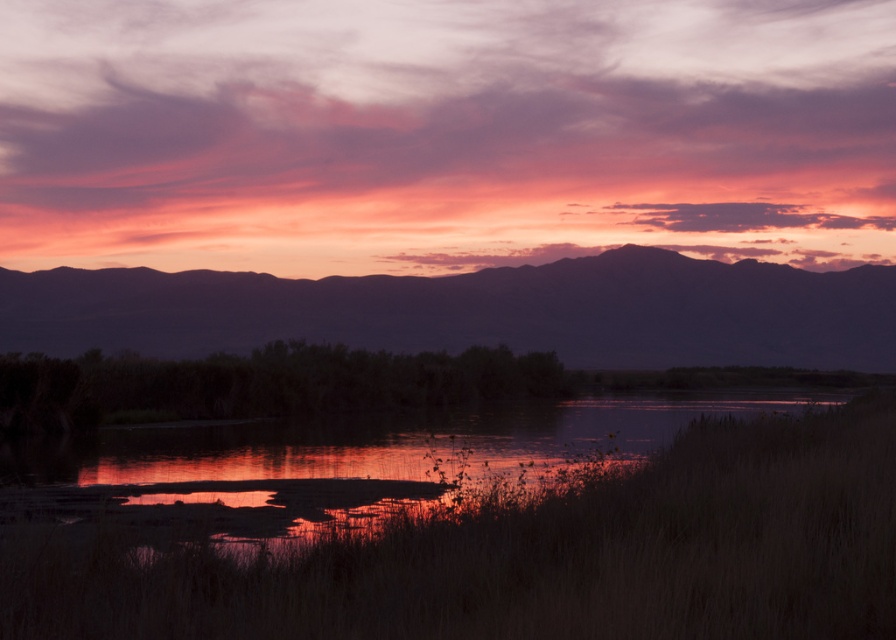
Question: Is silvery metallic mountain at upper center to the right of reflective wetland at center from the viewer's perspective?

Choices:
 (A) no
 (B) yes

Answer: (B)

Question: Among these objects, which one is farthest from the camera?

Choices:
 (A) silvery metallic mountain at upper center
 (B) reflective wetland at center

Answer: (A)

Question: Which object is farther from the camera taking this photo?

Choices:
 (A) reflective wetland at center
 (B) silvery metallic mountain at upper center

Answer: (B)

Question: Can you confirm if silvery metallic mountain at upper center is wider than reflective wetland at center?

Choices:
 (A) yes
 (B) no

Answer: (A)

Question: Can you confirm if silvery metallic mountain at upper center is positioned above reflective wetland at center?

Choices:
 (A) yes
 (B) no

Answer: (A)